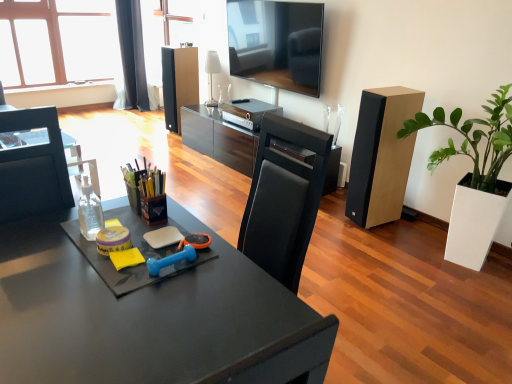
Question: Is white glossy lamp at upper center oriented away from green matte plant at right?

Choices:
 (A) yes
 (B) no

Answer: (B)

Question: Is white glossy lamp at upper center not near green matte plant at right?

Choices:
 (A) yes
 (B) no

Answer: (A)

Question: Considering the relative sizes of white glossy lamp at upper center and green matte plant at right in the image provided, is white glossy lamp at upper center wider than green matte plant at right?

Choices:
 (A) no
 (B) yes

Answer: (A)

Question: Is green matte plant at right inside white glossy lamp at upper center?

Choices:
 (A) yes
 (B) no

Answer: (B)

Question: Considering the relative positions of white glossy lamp at upper center and green matte plant at right in the image provided, is white glossy lamp at upper center to the right of green matte plant at right from the viewer's perspective?

Choices:
 (A) yes
 (B) no

Answer: (B)

Question: From the image's perspective, is matte black speaker at center, which is the 2th speaker from bottom to top, located above or below light brown wood speaker at right, placed as the first speaker when sorted from front to back?

Choices:
 (A) below
 (B) above

Answer: (B)

Question: Considering the positions of matte black speaker at center, acting as the first speaker starting from the left, and light brown wood speaker at right, which ranks as the 2th speaker in top-to-bottom order, in the image, is matte black speaker at center, acting as the first speaker starting from the left, bigger or smaller than light brown wood speaker at right, which ranks as the 2th speaker in top-to-bottom order,?

Choices:
 (A) big
 (B) small

Answer: (B)

Question: Is point (183, 79) closer or farther from the camera than point (358, 193)?

Choices:
 (A) closer
 (B) farther

Answer: (B)

Question: In the image, is matte black speaker at center, the 2th speaker viewed from the right, positioned in front of or behind light brown wood speaker at right, placed as the first speaker when sorted from front to back?

Choices:
 (A) front
 (B) behind

Answer: (B)

Question: In the image, is light brown wood speaker at right, the first speaker from the bottom, on the left side or the right side of black fabric curtain at upper left?

Choices:
 (A) right
 (B) left

Answer: (A)

Question: Based on their sizes in the image, would you say light brown wood speaker at right, arranged as the first speaker when viewed from the right, is bigger or smaller than black fabric curtain at upper left?

Choices:
 (A) big
 (B) small

Answer: (B)

Question: Is point (372, 183) closer or farther from the camera than point (118, 41)?

Choices:
 (A) closer
 (B) farther

Answer: (A)

Question: From a real-world perspective, is light brown wood speaker at right, the first speaker from the bottom, above or below black fabric curtain at upper left?

Choices:
 (A) below
 (B) above

Answer: (A)

Question: From a real-world perspective, is white glossy lamp at upper center above or below green matte plant at right?

Choices:
 (A) below
 (B) above

Answer: (B)

Question: Considering the relative positions of white glossy lamp at upper center and green matte plant at right in the image provided, is white glossy lamp at upper center to the left or to the right of green matte plant at right?

Choices:
 (A) right
 (B) left

Answer: (B)